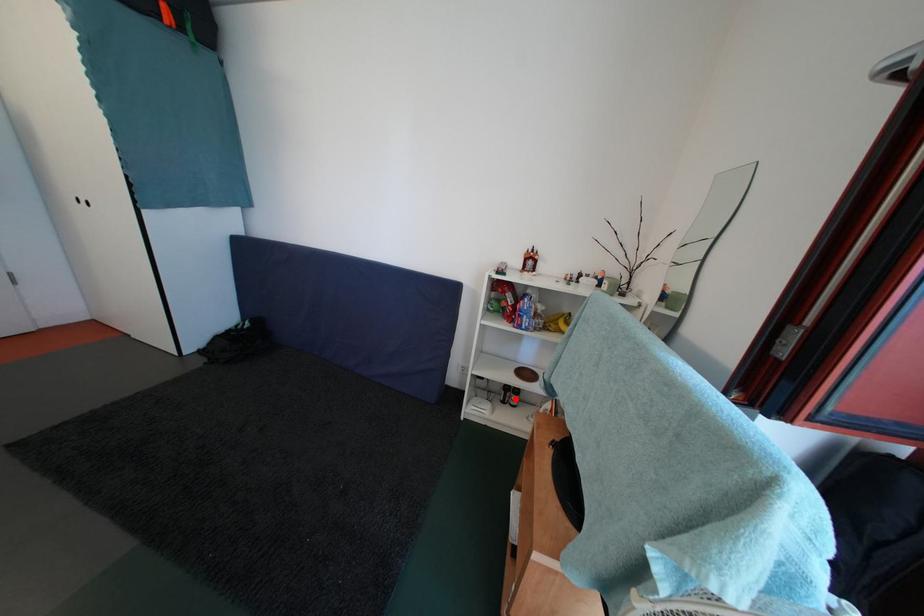
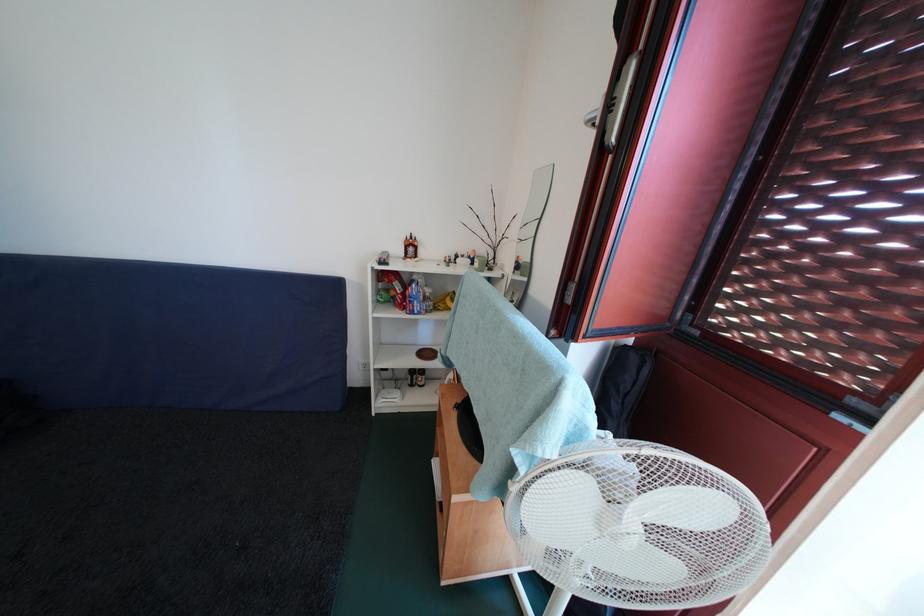
Find the pixel in the second image that matches the highlighted location in the first image.

(421, 382)